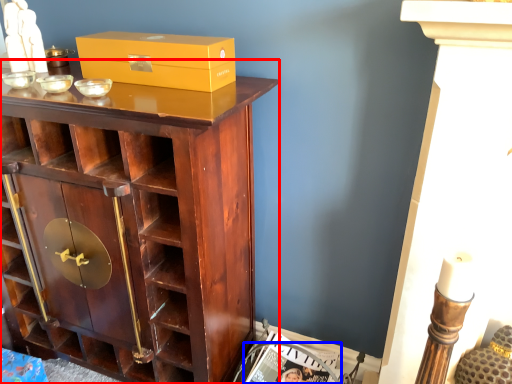
Question: Which point is closer to the camera, cupboard (highlighted by a red box) or magazine (highlighted by a blue box)?

Choices:
 (A) cupboard
 (B) magazine

Answer: (A)